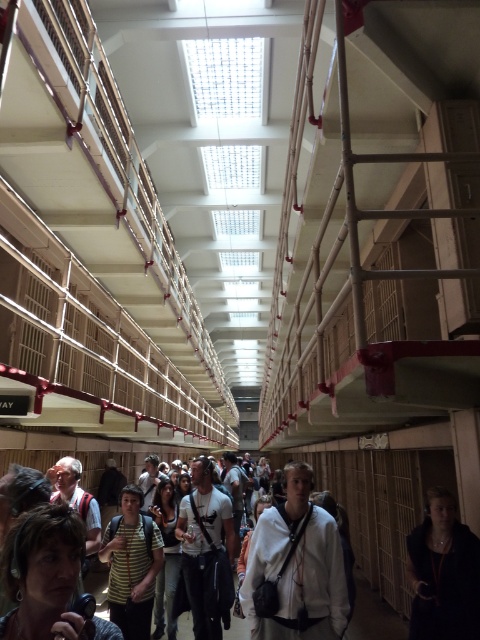
Between matte black headphones at lower left and striped shirt at center, which one appears on the right side from the viewer's perspective?

Positioned to the right is matte black headphones at lower left.

This screenshot has width=480, height=640. Identify the location of matte black headphones at lower left. (43, 573).

I want to click on matte black headphones at lower left, so click(x=43, y=573).

Can you confirm if white matte t-shirt at center is thinner than striped shirt at center?

Yes.

Can you confirm if white matte t-shirt at center is wider than striped shirt at center?

No, white matte t-shirt at center is not wider than striped shirt at center.

Where is `white matte t-shirt at center`? This screenshot has width=480, height=640. white matte t-shirt at center is located at coordinates (205, 552).

Does white matte jacket at center have a greater height compared to matte black headphones at lower left?

Correct, white matte jacket at center is much taller as matte black headphones at lower left.

Is white matte jacket at center to the left of matte black headphones at lower left from the viewer's perspective?

No, white matte jacket at center is not to the left of matte black headphones at lower left.

Between point (309, 560) and point (23, 545), which one is positioned behind?

The point (309, 560) is more distant.

Locate an element on the screen. white matte jacket at center is located at coordinates (296, 566).